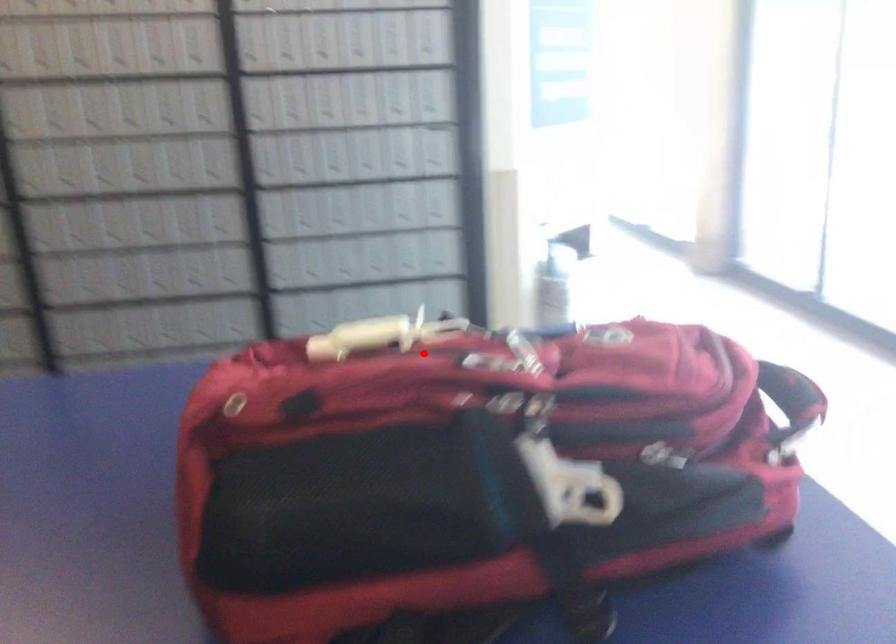
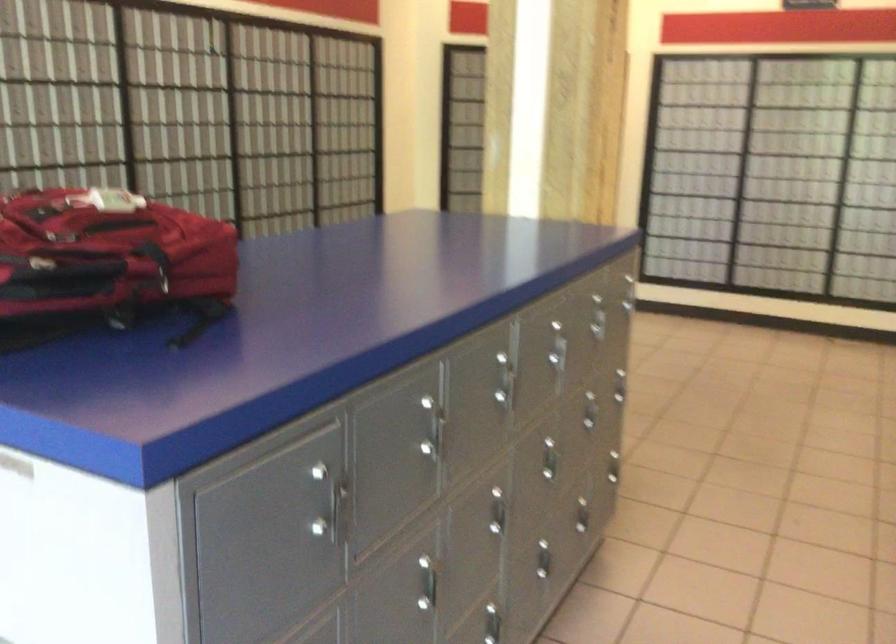
Locate, in the second image, the point that corresponds to the highlighted location in the first image.

(156, 263)